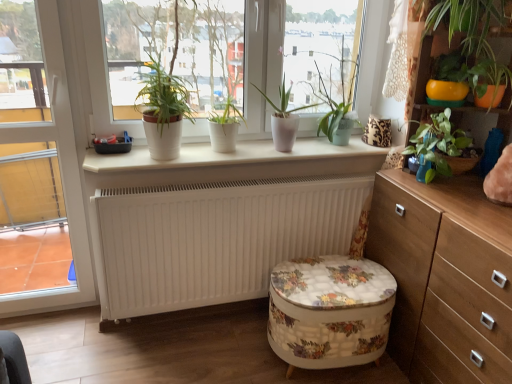
Find the location of a particular element. The height and width of the screenshot is (384, 512). free location in front of white matte pot at center, the 2th houseplant when ordered from left to right is located at coordinates (214, 159).